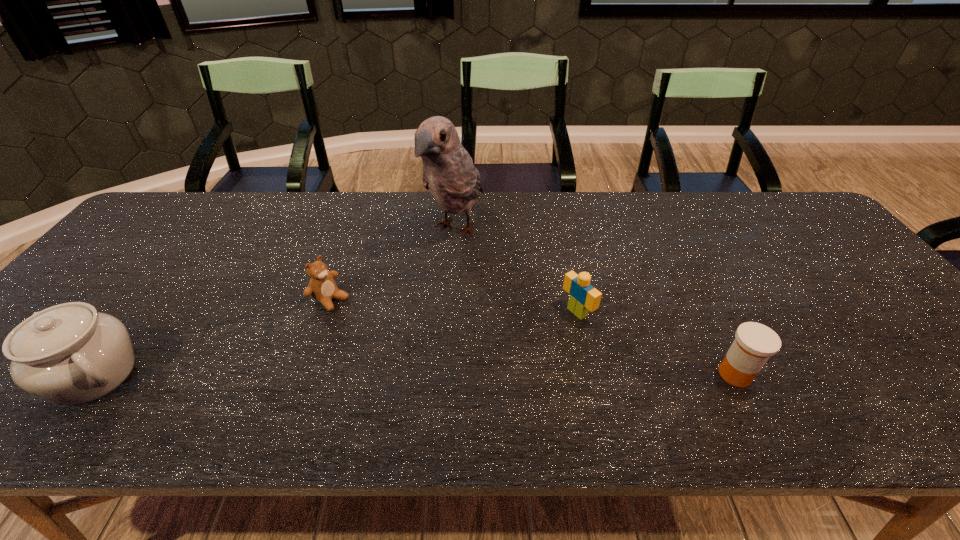
Find the location of a particular element. object that is at the left edge is located at coordinates (70, 354).

Find the location of a particular element. This screenshot has height=540, width=960. object that is at the near left corner is located at coordinates (70, 354).

Find the location of a particular element. vacant space at the far edge is located at coordinates (686, 234).

Image resolution: width=960 pixels, height=540 pixels. I want to click on vacant region at the near edge, so click(848, 358).

The image size is (960, 540). I want to click on free space at the left edge, so click(107, 275).

You are a GUI agent. You are given a task and a screenshot of the screen. Output one action in this format:
    pyautogui.click(x=<x>, y=<y>)
    Task: Click on the free space at the far left corner of the desktop
    This screenshot has height=540, width=960.
    Given the screenshot: What is the action you would take?
    pyautogui.click(x=172, y=218)

You are a GUI agent. You are given a task and a screenshot of the screen. Output one action in this format:
    pyautogui.click(x=<x>, y=<y>)
    Task: Click on the vacant area at the far right corner
    
    Given the screenshot: What is the action you would take?
    pyautogui.click(x=792, y=206)

Find the location of a particular element. This screenshot has height=540, width=960. free space between the third object from right to left and the teddy bear is located at coordinates (394, 264).

Locate an element on the screen. The height and width of the screenshot is (540, 960). vacant region between the farthest object and the teddy bear is located at coordinates (394, 264).

At what (x,y) coordinates should I click in order to perform the action: click on empty space that is in between the Lego and the teddy bear. Please return your answer as a coordinate pair (x, y). This screenshot has width=960, height=540. Looking at the image, I should click on (454, 306).